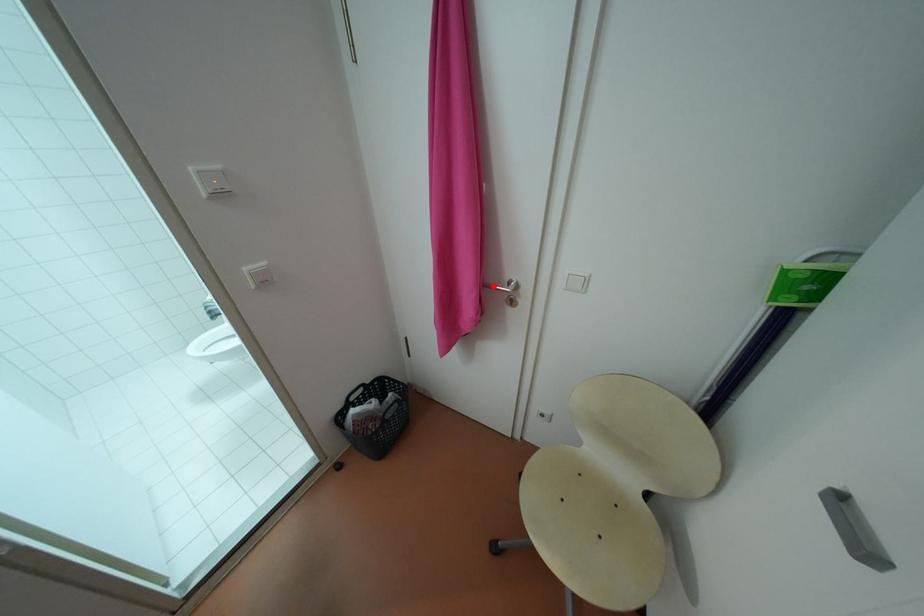
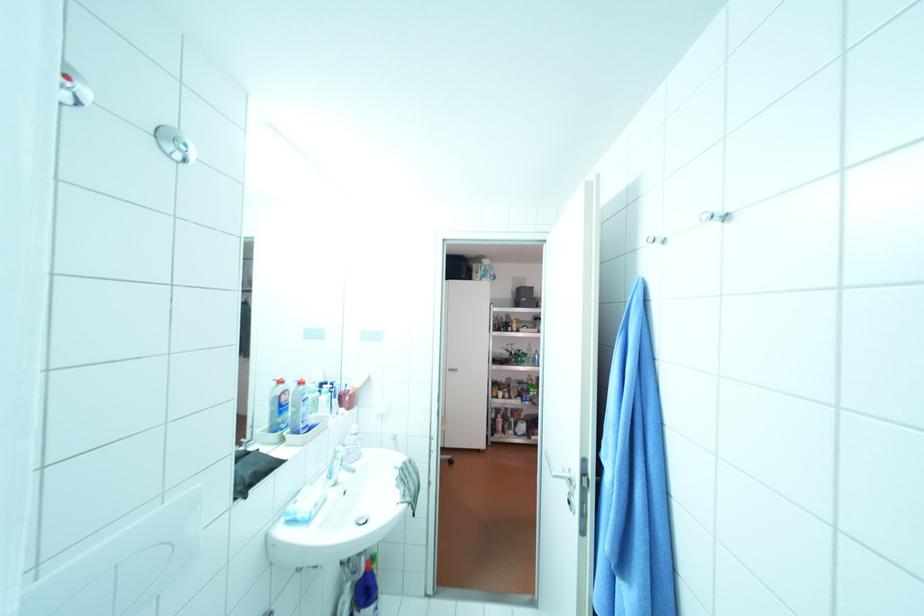
Question: I am providing you with two images of the same scene from different viewpoints. A red point is marked on the first image. Is the red point's position out of view in image 2?

Choices:
 (A) Yes
 (B) No

Answer: (A)